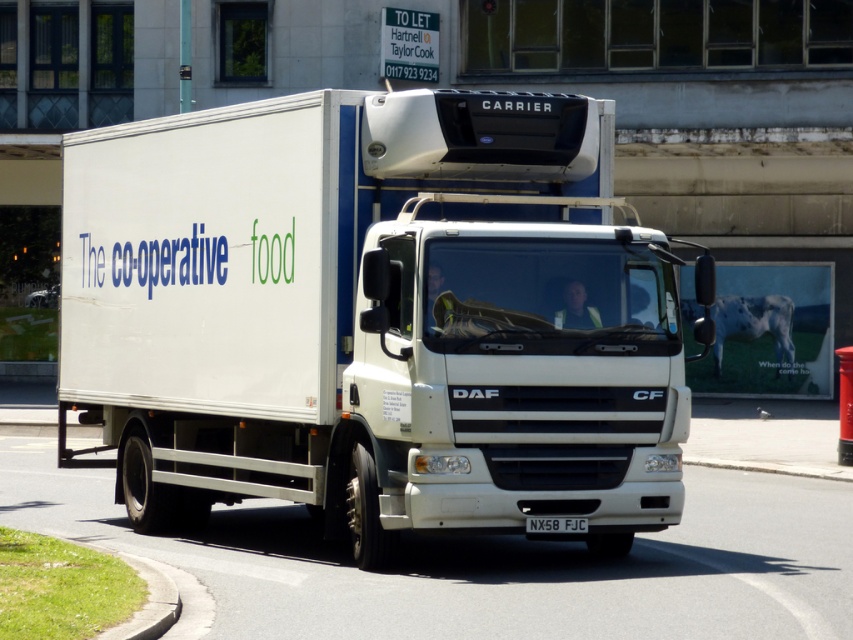
Between white matte truck at center and white plastic license plate at center, which one has less height?

white plastic license plate at center

Does white matte truck at center appear over white plastic license plate at center?

Yes, white matte truck at center is above white plastic license plate at center.

Where is `white matte truck at center`? white matte truck at center is located at coordinates pyautogui.click(x=374, y=316).

This screenshot has width=853, height=640. In order to click on white matte truck at center in this screenshot , I will do `click(374, 316)`.